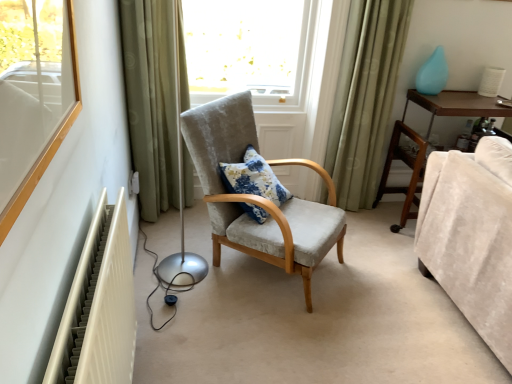
Find the location of `free space below teal glossy vase at upper right (from a real-world perspective)`. free space below teal glossy vase at upper right (from a real-world perspective) is located at coordinates (433, 92).